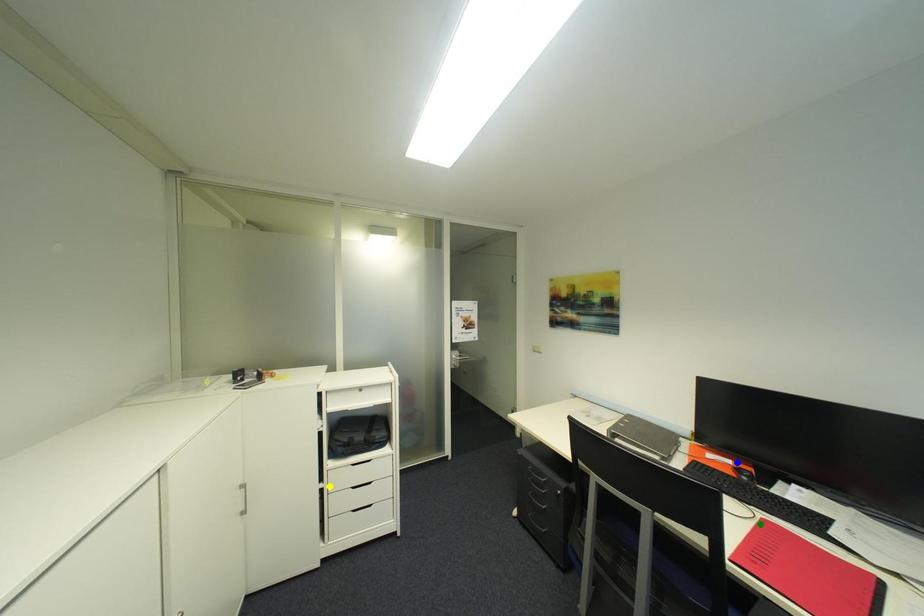
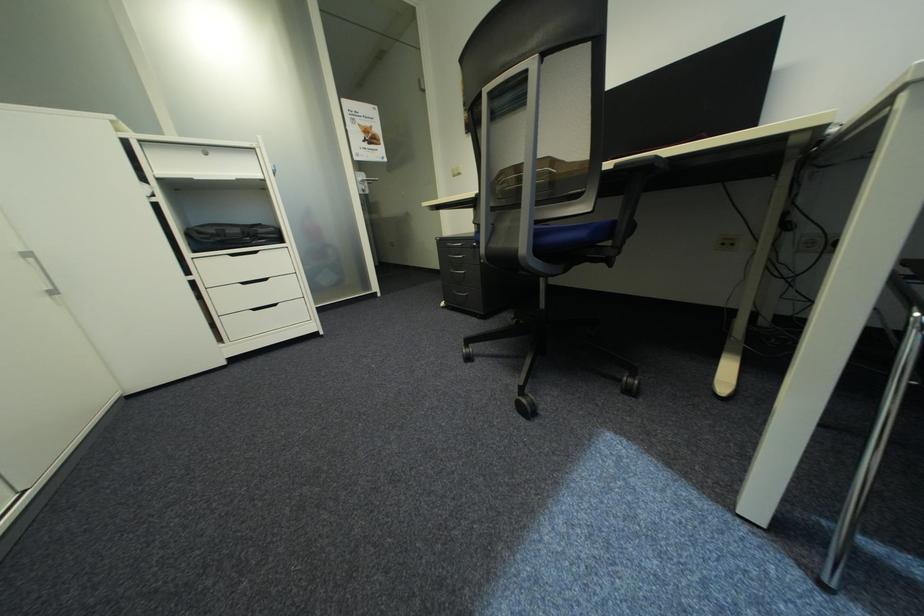
I am providing you with two images of the same scene from different viewpoints. Three points are marked in image1. Which point corresponds to a part or object that is occluded in image2?In image1, three points are marked. Which of them correspond to a part or object that is occluded in image2?Among the three points shown in image1, which one corresponds to a part or object that is no longer visible due to occlusion in image2?

Invisible in image2: green point, blue point.